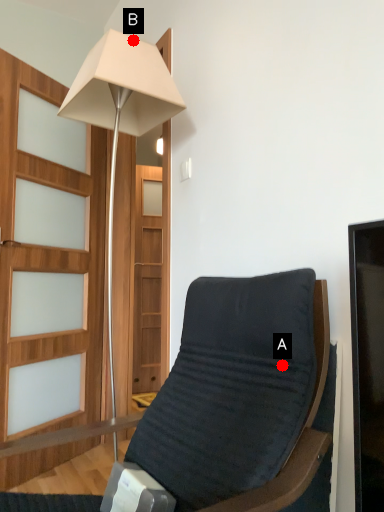
Question: Two points are circled on the image, labeled by A and B beside each circle. Which point is further to the camera?

Choices:
 (A) A is further
 (B) B is further

Answer: (B)